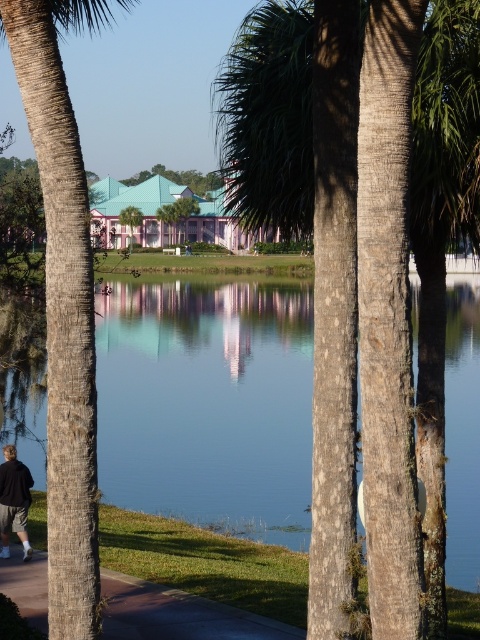
Which is behind, point (238, 349) or point (116, 596)?

The point (238, 349) is behind.

Between point (295, 289) and point (235, 621), which one is positioned in front?

Positioned in front is point (235, 621).

What do you see at coordinates (207, 403) in the screenshot? This screenshot has height=640, width=480. I see `blue glass water at center` at bounding box center [207, 403].

Locate an element on the screen. This screenshot has width=480, height=640. blue glass water at center is located at coordinates (207, 403).

Based on the photo, does blue glass water at center come behind brown textured palm tree at left?

No, it is not.

Is blue glass water at center above brown textured palm tree at left?

Incorrect, blue glass water at center is not positioned above brown textured palm tree at left.

Image resolution: width=480 pixels, height=640 pixels. Describe the element at coordinates (207, 403) in the screenshot. I see `blue glass water at center` at that location.

At what (x,y) coordinates should I click in order to perform the action: click on blue glass water at center. Please return your answer as a coordinate pair (x, y). Image resolution: width=480 pixels, height=640 pixels. Looking at the image, I should click on (207, 403).

Which of these two, paved asphalt path at lower center or black fabric person at lower left, stands taller?

black fabric person at lower left

Does paved asphalt path at lower center have a greater width compared to black fabric person at lower left?

Yes.

You are a GUI agent. You are given a task and a screenshot of the screen. Output one action in this format:
    pyautogui.click(x=<x>, y=<y>)
    Task: Click on the paved asphalt path at lower center
    This screenshot has height=640, width=480.
    Given the screenshot: What is the action you would take?
    pyautogui.click(x=178, y=614)